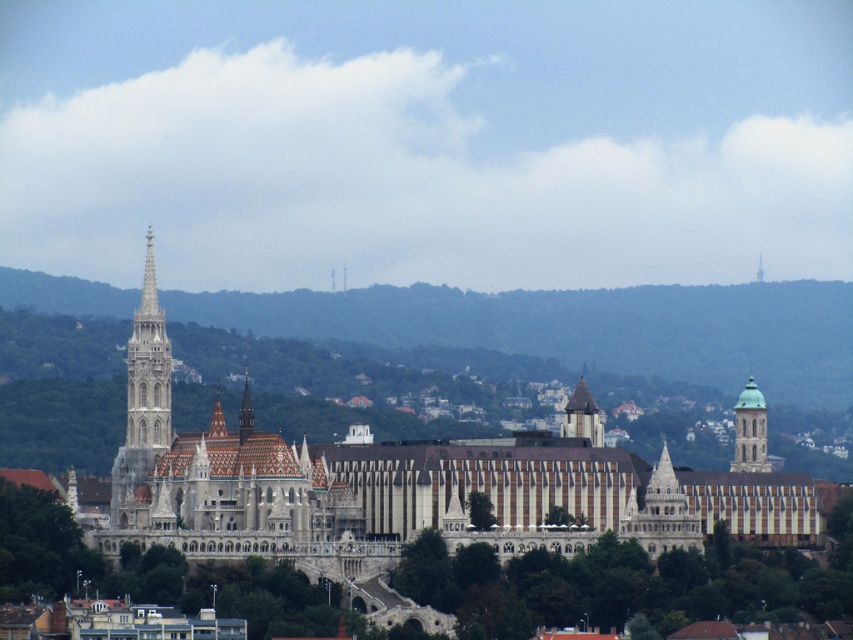
Is smooth stone tower at center to the right of smooth stone spire at center from the viewer's perspective?

Correct, you'll find smooth stone tower at center to the right of smooth stone spire at center.

Describe the element at coordinates (582, 417) in the screenshot. The width and height of the screenshot is (853, 640). I see `smooth stone tower at center` at that location.

The image size is (853, 640). What do you see at coordinates (582, 417) in the screenshot?
I see `smooth stone tower at center` at bounding box center [582, 417].

Locate an element on the screen. The width and height of the screenshot is (853, 640). smooth stone tower at center is located at coordinates (582, 417).

Who is lower down, green glass tower at upper right or smooth stone tower at center?

Positioned lower is green glass tower at upper right.

Which is in front, point (761, 448) or point (579, 403)?

Positioned in front is point (579, 403).

What are the coordinates of `green glass tower at upper right` in the screenshot? It's located at (750, 429).

Find the location of a particular element. white stone tower at left is located at coordinates (143, 397).

Which is more to the left, white stone tower at left or smooth stone spire at center?

white stone tower at left is more to the left.

Between point (120, 528) and point (252, 429), which one is positioned in front?

Point (252, 429)

Where is `white stone tower at left`? white stone tower at left is located at coordinates [x=143, y=397].